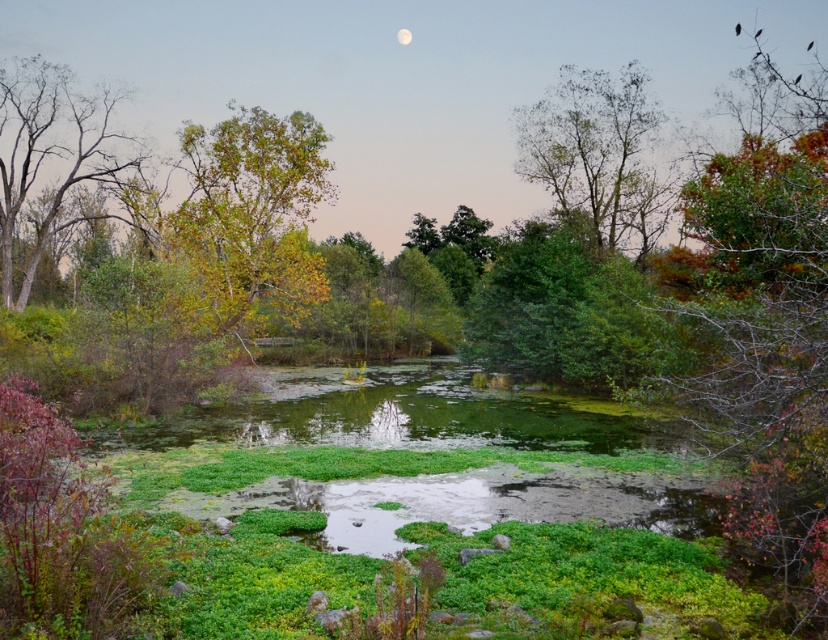
You are an observer standing in the middle of the scene. You see the green leafy tree at center and the bare wood tree at left. Which tree is higher up in the image?

The green leafy tree at center is above the bare wood tree at left, so it is higher up in the image.

Based on the photo, you are standing in the serene evening scene and want to determine which tree is taller between the green leafy tree at center and the bare wood tree at left. Based on the scene, which one is taller?

The green leafy tree at center is taller than the bare wood tree at left.

You are standing at the center of the image and looking towards the upper right corner. There is a point labeled as point (x=49, y=163). What object is located at this point?

The point (x=49, y=163) corresponds to the bare wood tree at left.